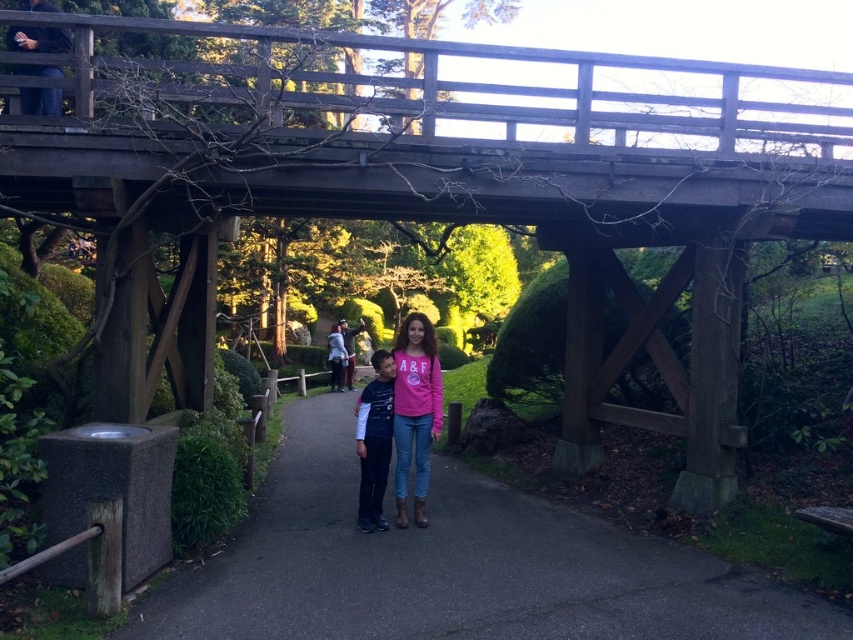
You are standing at the wooden bridge and want to walk to the point marked as point (392,396). There is another point marked as point (339,518) behind it. Which point should you aim for to reach the closer one first?

You should aim for point (392,396) first because it is closer to your current position at the wooden bridge than point (339,518), which is behind it.